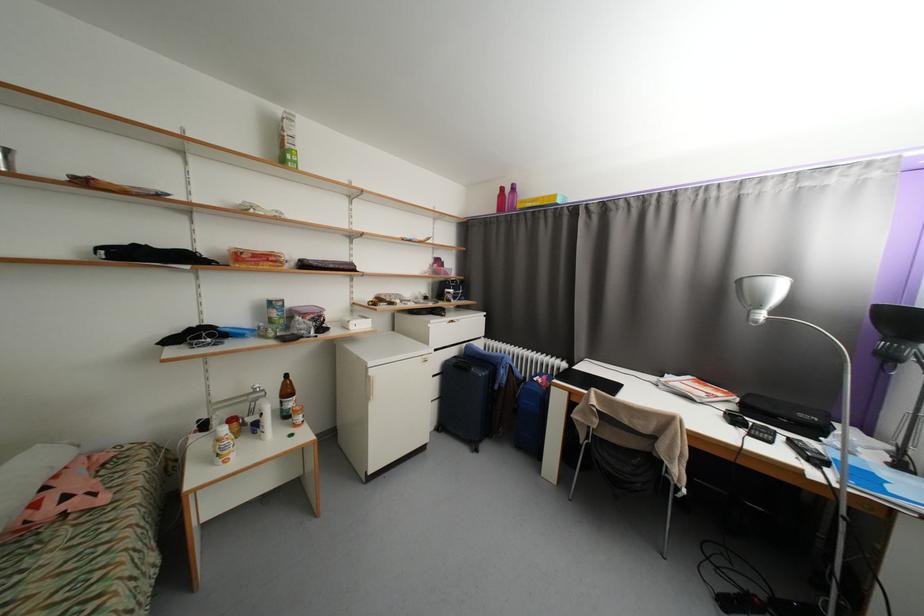
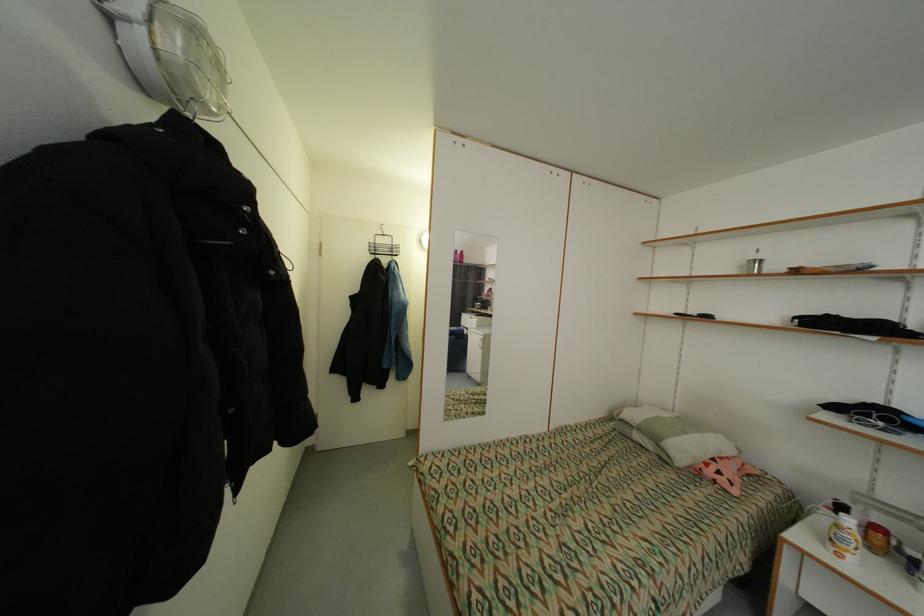
Question: Based on the continuous images, in which direction is the camera rotating? Reply with the corresponding letter.

Choices:
 (A) Left
 (B) Right
 (C) Up
 (D) Down

Answer: (A)